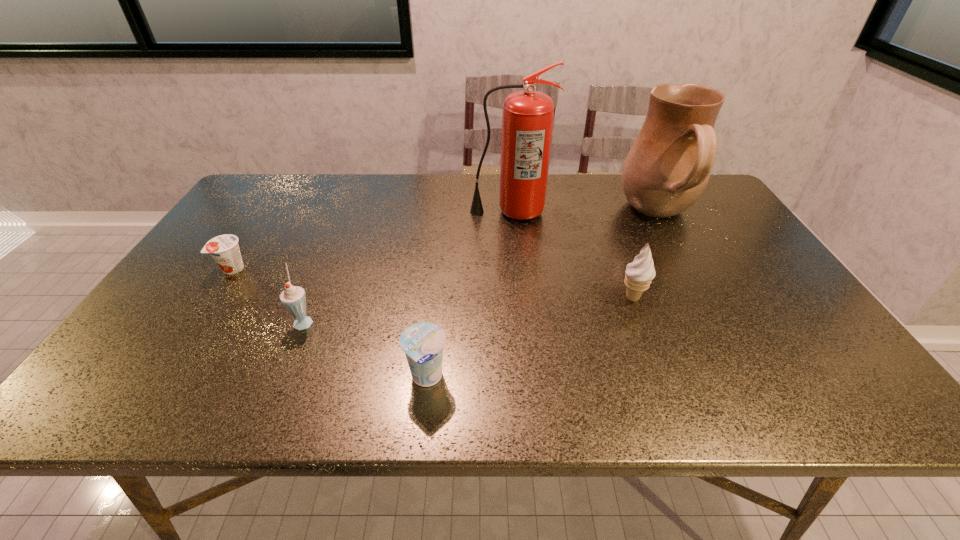
Where is `vacant area that lies between the fourth object from left to right and the milkshake`? The width and height of the screenshot is (960, 540). vacant area that lies between the fourth object from left to right and the milkshake is located at coordinates (407, 266).

Where is `empty space that is in between the fourth nearest object and the second object from right to left`? The image size is (960, 540). empty space that is in between the fourth nearest object and the second object from right to left is located at coordinates (433, 284).

Where is `free spot between the milkshake and the rightmost object`? free spot between the milkshake and the rightmost object is located at coordinates (482, 268).

Select which object appears as the closest to the nearer yogurt. Please provide its 2D coordinates. Your answer should be formatted as a tuple, i.e. [(x, y)], where the tuple contains the x and y coordinates of a point satisfying the conditions above.

[(293, 298)]

Select which object is the fourth closest to the third farthest object. Please provide its 2D coordinates. Your answer should be formatted as a tuple, i.e. [(x, y)], where the tuple contains the x and y coordinates of a point satisfying the conditions above.

[(638, 275)]